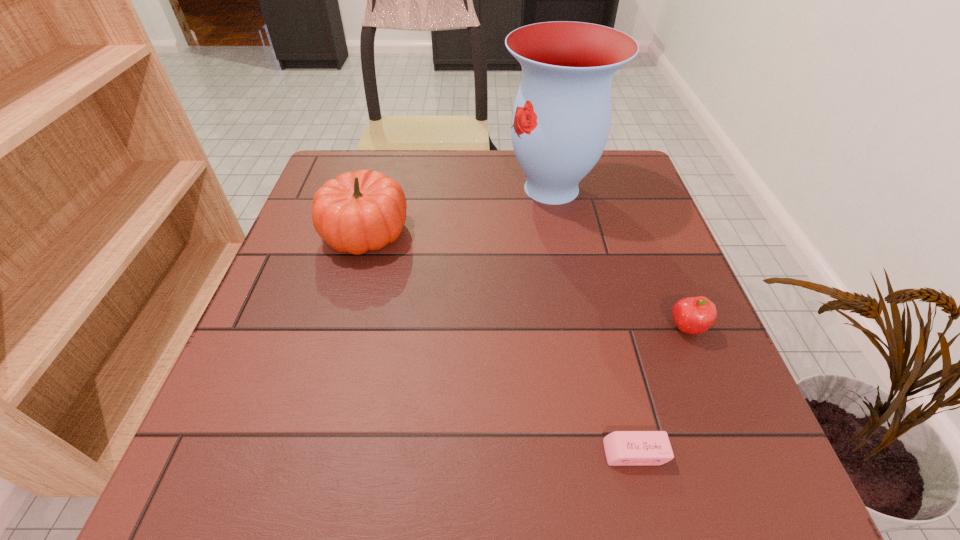
Where is `free spot that satisfies the following two spatial constraints: 1. on the front side of the nearest object; 2. on the left side of the tallest object`? free spot that satisfies the following two spatial constraints: 1. on the front side of the nearest object; 2. on the left side of the tallest object is located at coordinates (603, 453).